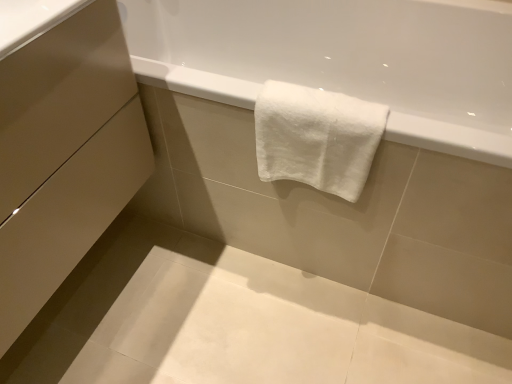
Question: Can you confirm if matte beige drawer at lower left, marked as the 1th drawer in a bottom-to-top arrangement, is smaller than white cotton towel at upper center?

Choices:
 (A) yes
 (B) no

Answer: (B)

Question: Does matte beige drawer at lower left, marked as the 2th drawer in a top-to-bottom arrangement, appear on the left side of white cotton towel at upper center?

Choices:
 (A) no
 (B) yes

Answer: (B)

Question: Does matte beige drawer at lower left, marked as the 2th drawer in a top-to-bottom arrangement, have a greater height compared to white cotton towel at upper center?

Choices:
 (A) no
 (B) yes

Answer: (B)

Question: Can you confirm if matte beige drawer at lower left, marked as the 2th drawer in a top-to-bottom arrangement, is bigger than white cotton towel at upper center?

Choices:
 (A) no
 (B) yes

Answer: (B)

Question: From the image's perspective, would you say matte beige drawer at lower left, marked as the 1th drawer in a bottom-to-top arrangement, is shown under white cotton towel at upper center?

Choices:
 (A) no
 (B) yes

Answer: (B)

Question: Does point (14, 190) appear closer or farther from the camera than point (17, 233)?

Choices:
 (A) farther
 (B) closer

Answer: (B)

Question: Is matte beige drawer at lower left, the second drawer positioned from the bottom, taller or shorter than matte beige drawer at lower left, marked as the 1th drawer in a bottom-to-top arrangement?

Choices:
 (A) tall
 (B) short

Answer: (B)

Question: Looking at their shapes, would you say matte beige drawer at lower left, the second drawer positioned from the bottom, is wider or thinner than matte beige drawer at lower left, marked as the 1th drawer in a bottom-to-top arrangement?

Choices:
 (A) thin
 (B) wide

Answer: (A)

Question: Is matte beige drawer at lower left, which is the 1th drawer from top to bottom, spatially inside matte beige drawer at lower left, marked as the 1th drawer in a bottom-to-top arrangement, or outside of it?

Choices:
 (A) inside
 (B) outside

Answer: (A)

Question: In terms of size, does matte beige drawer at lower left, marked as the 1th drawer in a bottom-to-top arrangement, appear bigger or smaller than white cotton towel at upper center?

Choices:
 (A) small
 (B) big

Answer: (B)

Question: Is matte beige drawer at lower left, marked as the 2th drawer in a top-to-bottom arrangement, situated inside white cotton towel at upper center or outside?

Choices:
 (A) inside
 (B) outside

Answer: (B)

Question: In the image, is matte beige drawer at lower left, marked as the 2th drawer in a top-to-bottom arrangement, positioned in front of or behind white cotton towel at upper center?

Choices:
 (A) behind
 (B) front

Answer: (B)

Question: Is point (42, 304) positioned closer to the camera than point (334, 183)?

Choices:
 (A) closer
 (B) farther

Answer: (A)

Question: Considering the positions of matte beige drawer at lower left, marked as the 2th drawer in a top-to-bottom arrangement, and matte beige drawer at lower left, which is the 1th drawer from top to bottom, in the image, is matte beige drawer at lower left, marked as the 2th drawer in a top-to-bottom arrangement, wider or thinner than matte beige drawer at lower left, which is the 1th drawer from top to bottom,?

Choices:
 (A) wide
 (B) thin

Answer: (A)

Question: Is point (115, 134) positioned closer to the camera than point (86, 112)?

Choices:
 (A) farther
 (B) closer

Answer: (A)